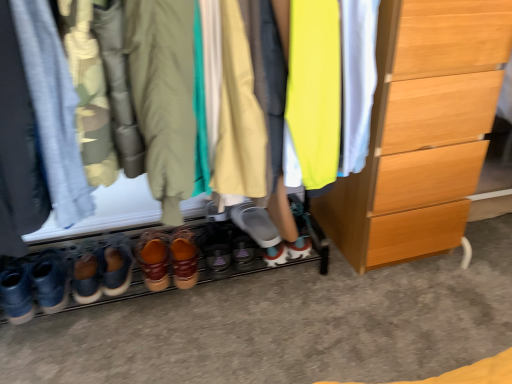
Measure the distance between point (x=294, y=145) and camera.

Point (x=294, y=145) and camera are 3.44 feet apart.

The image size is (512, 384). Describe the element at coordinates (184, 258) in the screenshot. I see `leather-like brown shoes at center, arranged as the second footwear when viewed from the right` at that location.

Describe the element at coordinates (86, 274) in the screenshot. I see `leather brown shoes at lower left, the sixth footwear in the right-to-left sequence` at that location.

Find the location of a particular element. Image resolution: width=512 pixels, height=384 pixels. leather shoes at lower center is located at coordinates (161, 96).

What do you see at coordinates (153, 261) in the screenshot? The height and width of the screenshot is (384, 512). I see `leather boots at center, which is counted as the fourth footwear, starting from the left` at bounding box center [153, 261].

You are a GUI agent. You are given a task and a screenshot of the screen. Output one action in this format:
    pyautogui.click(x=<x>, y=<y>)
    Task: Click on the neon yellow fabric at center, which is counted as the 1th clothing, starting from the right
    
    Given the screenshot: What is the action you would take?
    pos(315,89)

Which is less distant, (97, 283) or (114, 293)?

The point (97, 283) is closer to the camera.

Looking at this image, based on their positions, is leather brown shoes at lower left, the sixth footwear in the right-to-left sequence, located to the left or right of brown suede shoes at lower center, which ranks as the fifth footwear in right-to-left order?

leather brown shoes at lower left, the sixth footwear in the right-to-left sequence, is positioned on brown suede shoes at lower center, which ranks as the fifth footwear in right-to-left order,'s left side.

Measure the distance from leather brown shoes at lower left, the sixth footwear in the right-to-left sequence, to brown suede shoes at lower center, which ranks as the 2th footwear in left-to-right order.

6.20 centimeters.

Are leather brown shoes at lower left, the sixth footwear in the right-to-left sequence, and brown suede shoes at lower center, which ranks as the 2th footwear in left-to-right order, located far from each other?

leather brown shoes at lower left, the sixth footwear in the right-to-left sequence, is actually quite close to brown suede shoes at lower center, which ranks as the 2th footwear in left-to-right order.

Can you tell me how much leather-like brown shoes at center, placed as the 5th footwear when sorted from left to right, and wooden chest of drawers at right differ in facing direction?

2.48 degrees.

Considering the relative sizes of leather-like brown shoes at center, placed as the 5th footwear when sorted from left to right, and wooden chest of drawers at right in the image provided, is leather-like brown shoes at center, placed as the 5th footwear when sorted from left to right, thinner than wooden chest of drawers at right?

Yes, leather-like brown shoes at center, placed as the 5th footwear when sorted from left to right, is thinner than wooden chest of drawers at right.

Does leather-like brown shoes at center, placed as the 5th footwear when sorted from left to right, lie behind wooden chest of drawers at right?

Yes, it is.

From the image's perspective, which one is positioned lower, leather-like brown shoes at center, placed as the 5th footwear when sorted from left to right, or wooden chest of drawers at right?

leather-like brown shoes at center, placed as the 5th footwear when sorted from left to right.

In the scene shown: Could you tell me if brown suede shoes at lower center, which ranks as the 2th footwear in left-to-right order, is turned towards matte gray shoe at center, which is the 6th footwear in left-to-right order?

No, brown suede shoes at lower center, which ranks as the 2th footwear in left-to-right order, does not turn towards matte gray shoe at center, which is the 6th footwear in left-to-right order.

How different are the orientations of brown suede shoes at lower center, which ranks as the 2th footwear in left-to-right order, and matte gray shoe at center, which is the 6th footwear in left-to-right order, in degrees?

12.1 degrees separate the facing orientations of brown suede shoes at lower center, which ranks as the 2th footwear in left-to-right order, and matte gray shoe at center, which is the 6th footwear in left-to-right order.

In the scene shown: Does brown suede shoes at lower center, which ranks as the fifth footwear in right-to-left order, have a lesser height compared to matte gray shoe at center, which is the 6th footwear in left-to-right order?

Incorrect, the height of brown suede shoes at lower center, which ranks as the fifth footwear in right-to-left order, does not fall short of that of matte gray shoe at center, which is the 6th footwear in left-to-right order.

From the image's perspective, does brown suede shoes at lower center, which ranks as the 2th footwear in left-to-right order, appear lower than matte gray shoe at center, which is counted as the 1th footwear, starting from the right?

Indeed, from the image's perspective, brown suede shoes at lower center, which ranks as the 2th footwear in left-to-right order, is shown beneath matte gray shoe at center, which is counted as the 1th footwear, starting from the right.

The width and height of the screenshot is (512, 384). I want to click on clothing on the left of leather-like brown shoes at center, placed as the 5th footwear when sorted from left to right, so click(53, 110).

Between leather-like brown shoes at center, placed as the 5th footwear when sorted from left to right, and denim pants at left, the fourth clothing from the right, which one has more height?

denim pants at left, the fourth clothing from the right.

Does leather-like brown shoes at center, placed as the 5th footwear when sorted from left to right, have a smaller size compared to denim pants at left, acting as the first clothing starting from the left?

Indeed, leather-like brown shoes at center, placed as the 5th footwear when sorted from left to right, has a smaller size compared to denim pants at left, acting as the first clothing starting from the left.

Does leather-like brown shoes at center, placed as the 5th footwear when sorted from left to right, have a lesser width compared to denim pants at left, the fourth clothing from the right?

Indeed, leather-like brown shoes at center, placed as the 5th footwear when sorted from left to right, has a lesser width compared to denim pants at left, the fourth clothing from the right.

What's the angular difference between khaki cotton jacket at center, which is counted as the 2th clothing, starting from the left, and matte gray shoe at center, which is counted as the 1th footwear, starting from the right,'s facing directions?

11.5 degrees separate the facing orientations of khaki cotton jacket at center, which is counted as the 2th clothing, starting from the left, and matte gray shoe at center, which is counted as the 1th footwear, starting from the right.

Locate an element on the screen. This screenshot has height=384, width=512. footwear that is the 1st one below the khaki cotton jacket at center, which is the third clothing from right to left (from a real-world perspective) is located at coordinates (256, 224).

Is matte gray shoe at center, which is counted as the 1th footwear, starting from the right, completely or partially inside khaki cotton jacket at center, which is counted as the 2th clothing, starting from the left?

No, matte gray shoe at center, which is counted as the 1th footwear, starting from the right, is not inside khaki cotton jacket at center, which is counted as the 2th clothing, starting from the left.

The height and width of the screenshot is (384, 512). Identify the location of the 5th footwear below the neon yellow fabric at center, positioned as the 4th clothing in left-to-right order (from a real-world perspective). (153, 259).

From the picture: Which of these two, leather brown shoes at center, which is counted as the 3th footwear, starting from the left, or neon yellow fabric at center, which is counted as the 1th clothing, starting from the right, stands taller?

With more height is neon yellow fabric at center, which is counted as the 1th clothing, starting from the right.

Does leather brown shoes at center, which appears as the 4th footwear when viewed from the right, turn towards neon yellow fabric at center, which is counted as the 1th clothing, starting from the right?

No, leather brown shoes at center, which appears as the 4th footwear when viewed from the right, is not facing towards neon yellow fabric at center, which is counted as the 1th clothing, starting from the right.

Is leather brown shoes at center, which is counted as the 3th footwear, starting from the left, inside or outside of neon yellow fabric at center, which is counted as the 1th clothing, starting from the right?

leather brown shoes at center, which is counted as the 3th footwear, starting from the left, lies outside neon yellow fabric at center, which is counted as the 1th clothing, starting from the right.

From the image's perspective, is leather boots at center, which is counted as the fourth footwear, starting from the left, under light yellow fabric at center, which ranks as the third clothing in left-to-right order?

Yes, from the image's perspective, leather boots at center, which is counted as the fourth footwear, starting from the left, is below light yellow fabric at center, which ranks as the third clothing in left-to-right order.

From a real-world perspective, is leather boots at center, the 3th footwear when ordered from right to left, physically above light yellow fabric at center, which ranks as the second clothing in right-to-left order?

No.

Are leather boots at center, the 3th footwear when ordered from right to left, and light yellow fabric at center, which ranks as the second clothing in right-to-left order, located far from each other?

No, leather boots at center, the 3th footwear when ordered from right to left, is not far away from light yellow fabric at center, which ranks as the second clothing in right-to-left order.

Which is more to the right, leather boots at center, the 3th footwear when ordered from right to left, or light yellow fabric at center, which ranks as the third clothing in left-to-right order?

light yellow fabric at center, which ranks as the third clothing in left-to-right order.

At what (x,y) coordinates should I click in order to perform the action: click on footwear that is the 1st one when counting rightward from the leather brown shoes at lower left, the sixth footwear in the right-to-left sequence. Please return your answer as a coordinate pair (x, y). The height and width of the screenshot is (384, 512). Looking at the image, I should click on (117, 266).

Identify the location of footwear that is the 5th one when counting backward from the wooden chest of drawers at right. The width and height of the screenshot is (512, 384). (184, 258).

Estimate the real-world distances between objects in this image. Which object is further from leather brown shoes at center, which is counted as the 3th footwear, starting from the left, light yellow fabric at center, which ranks as the second clothing in right-to-left order, or leather shoes at lower center?

leather shoes at lower center lies further to leather brown shoes at center, which is counted as the 3th footwear, starting from the left, than the other object.

Considering their positions, is light yellow fabric at center, which ranks as the third clothing in left-to-right order, positioned further to khaki cotton jacket at center, which is the third clothing from right to left, than leather shoes at lower center?

light yellow fabric at center, which ranks as the third clothing in left-to-right order.

Based on their spatial positions, is neon yellow fabric at center, positioned as the 4th clothing in left-to-right order, or leather-like brown shoes at center, arranged as the second footwear when viewed from the right, further from matte gray shoe at center, which is counted as the 1th footwear, starting from the right?

Based on the image, neon yellow fabric at center, positioned as the 4th clothing in left-to-right order, appears to be further to matte gray shoe at center, which is counted as the 1th footwear, starting from the right.

When comparing their distances from brown suede shoes at lower center, which ranks as the fifth footwear in right-to-left order, does leather-like brown shoes at center, placed as the 5th footwear when sorted from left to right, or leather shoes at lower center seem further?

The object further to brown suede shoes at lower center, which ranks as the fifth footwear in right-to-left order, is leather shoes at lower center.

Looking at the image, which one is located closer to leather brown shoes at lower left, the sixth footwear in the right-to-left sequence, leather shoes at lower center or leather boots at center, which is counted as the fourth footwear, starting from the left?

leather boots at center, which is counted as the fourth footwear, starting from the left, is positioned closer to the anchor leather brown shoes at lower left, the sixth footwear in the right-to-left sequence.

Based on their spatial positions, is leather shoes at lower center or leather-like brown shoes at center, placed as the 5th footwear when sorted from left to right, further from leather boots at center, the 3th footwear when ordered from right to left?

leather shoes at lower center is further to leather boots at center, the 3th footwear when ordered from right to left.

Looking at the image, which one is located further to khaki cotton jacket at center, which is counted as the 2th clothing, starting from the left, leather shoes at lower center or wooden chest of drawers at right?

Among the two, wooden chest of drawers at right is located further to khaki cotton jacket at center, which is counted as the 2th clothing, starting from the left.

From the image, which object appears to be nearer to leather brown shoes at center, which is counted as the 3th footwear, starting from the left, khaki cotton jacket at center, which is the third clothing from right to left, or leather boots at center, which is counted as the fourth footwear, starting from the left?

leather boots at center, which is counted as the fourth footwear, starting from the left, is positioned closer to the anchor leather brown shoes at center, which is counted as the 3th footwear, starting from the left.

Where is `closet between khaki cotton jacket at center, which is counted as the 2th clothing, starting from the left, and matte gray shoe at center, which is counted as the 1th footwear, starting from the right, in the front-back direction`? closet between khaki cotton jacket at center, which is counted as the 2th clothing, starting from the left, and matte gray shoe at center, which is counted as the 1th footwear, starting from the right, in the front-back direction is located at coordinates (161, 96).

Find the location of `closet situated between denim pants at left, acting as the first clothing starting from the left, and khaki cotton jacket at center, which is counted as the 2th clothing, starting from the left, from left to right`. closet situated between denim pants at left, acting as the first clothing starting from the left, and khaki cotton jacket at center, which is counted as the 2th clothing, starting from the left, from left to right is located at coordinates 161,96.

What are the coordinates of `closet situated between leather brown shoes at lower left, the 1th footwear viewed from the left, and neon yellow fabric at center, positioned as the 4th clothing in left-to-right order, from left to right` in the screenshot? It's located at (161, 96).

The image size is (512, 384). I want to click on closet located between denim pants at left, the fourth clothing from the right, and light yellow fabric at center, which ranks as the third clothing in left-to-right order, in the left-right direction, so click(x=161, y=96).